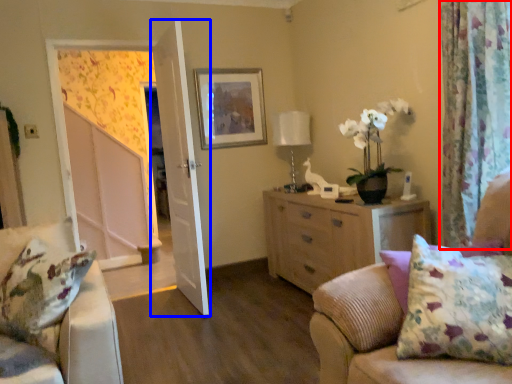
Question: Among these objects, which one is farthest to the camera, curtain (highlighted by a red box) or door (highlighted by a blue box)?

Choices:
 (A) curtain
 (B) door

Answer: (B)